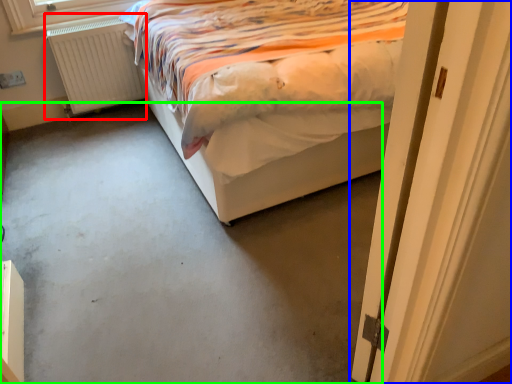
Question: Which object is the farthest from radiator (highlighted by a red box)? Choose among these: door (highlighted by a blue box) or concrete (highlighted by a green box).

Choices:
 (A) door
 (B) concrete

Answer: (A)